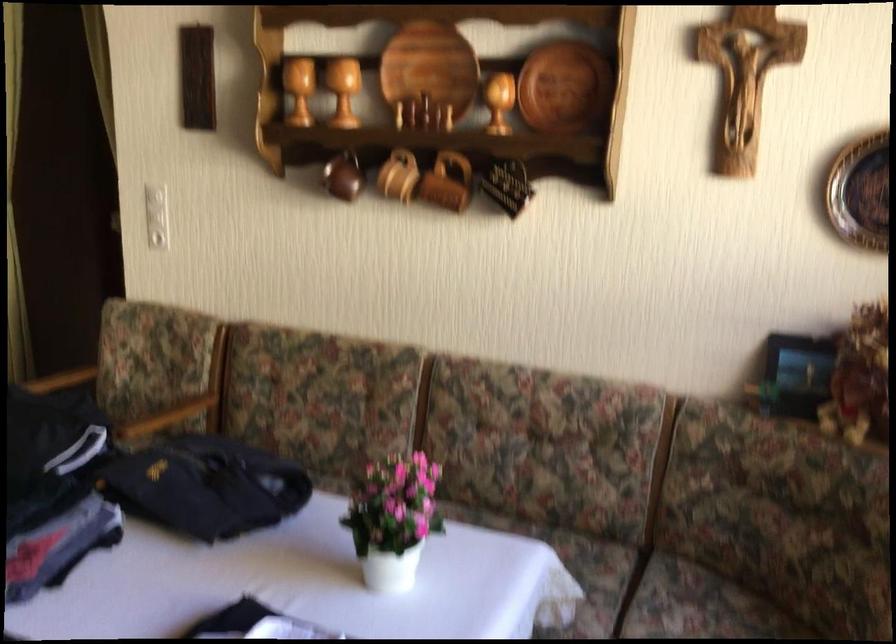
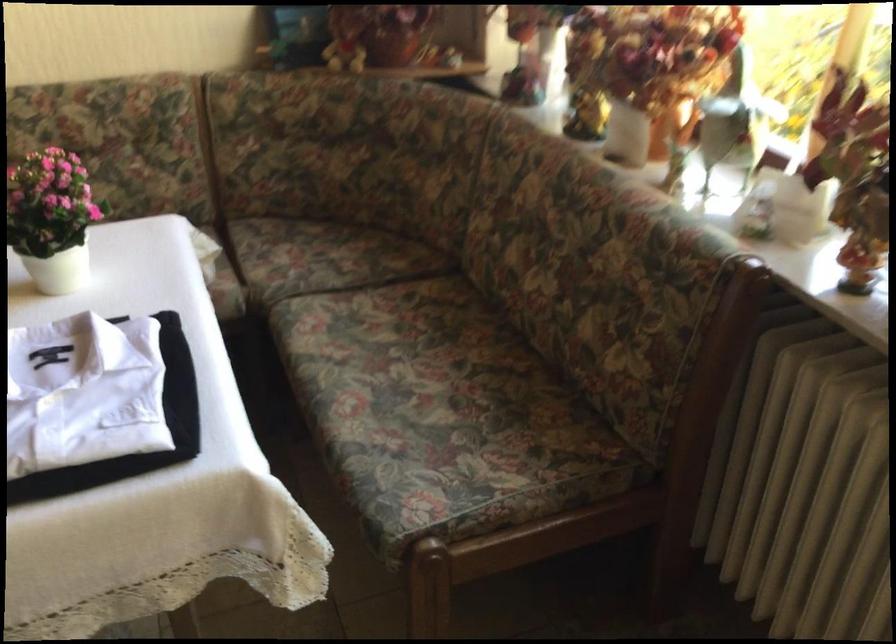
Locate, in the second image, the point that corresponds to [401,522] in the first image.

(52, 218)